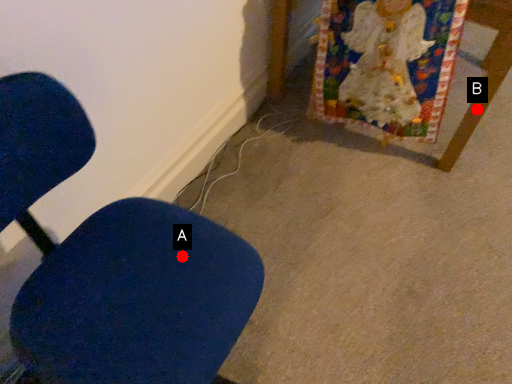
Question: Two points are circled on the image, labeled by A and B beside each circle. Among these points, which one is nearest to the camera?

Choices:
 (A) A is closer
 (B) B is closer

Answer: (A)